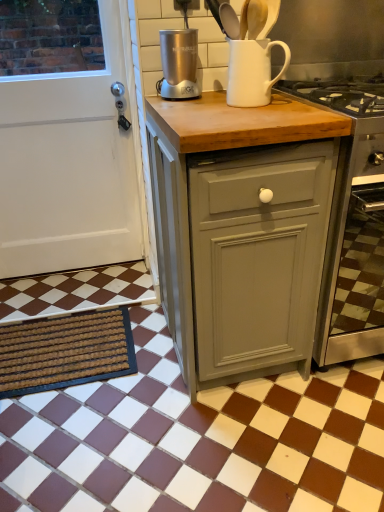
Question: Does brown textured mat at lower left have a greater width compared to matte gray cabinet at center?

Choices:
 (A) yes
 (B) no

Answer: (B)

Question: Can you confirm if brown textured mat at lower left is thinner than matte gray cabinet at center?

Choices:
 (A) yes
 (B) no

Answer: (A)

Question: Is brown textured mat at lower left closer to camera compared to matte gray cabinet at center?

Choices:
 (A) yes
 (B) no

Answer: (B)

Question: Considering the relative sizes of brown textured mat at lower left and matte gray cabinet at center in the image provided, is brown textured mat at lower left shorter than matte gray cabinet at center?

Choices:
 (A) no
 (B) yes

Answer: (B)

Question: From the image's perspective, does brown textured mat at lower left appear lower than matte gray cabinet at center?

Choices:
 (A) yes
 (B) no

Answer: (A)

Question: Is brown textured mat at lower left at the right side of matte gray cabinet at center?

Choices:
 (A) no
 (B) yes

Answer: (A)

Question: Is brown/white checkered tile at lower center behind satin silver blender at center?

Choices:
 (A) no
 (B) yes

Answer: (A)

Question: From a real-world perspective, is brown/white checkered tile at lower center physically below satin silver blender at center?

Choices:
 (A) no
 (B) yes

Answer: (B)

Question: Can you confirm if brown/white checkered tile at lower center is thinner than satin silver blender at center?

Choices:
 (A) no
 (B) yes

Answer: (A)

Question: Could you tell me if brown/white checkered tile at lower center is turned towards satin silver blender at center?

Choices:
 (A) yes
 (B) no

Answer: (B)

Question: Considering the relative sizes of brown/white checkered tile at lower center and satin silver blender at center in the image provided, is brown/white checkered tile at lower center smaller than satin silver blender at center?

Choices:
 (A) no
 (B) yes

Answer: (A)

Question: Would you say satin silver blender at center is part of brown/white checkered tile at lower center's contents?

Choices:
 (A) yes
 (B) no

Answer: (B)

Question: Is satin silver blender at center bigger than white matte jug at upper center?

Choices:
 (A) no
 (B) yes

Answer: (A)